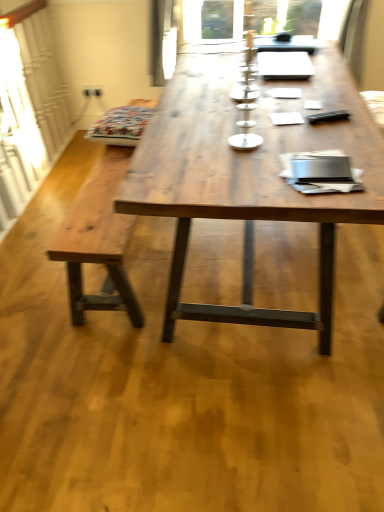
Question: Can you confirm if wooden table at center is shorter than wooden bench at left?

Choices:
 (A) no
 (B) yes

Answer: (A)

Question: Would you consider wooden table at center to be distant from wooden bench at left?

Choices:
 (A) yes
 (B) no

Answer: (B)

Question: From a real-world perspective, is wooden table at center under wooden bench at left?

Choices:
 (A) yes
 (B) no

Answer: (B)

Question: Can you confirm if wooden table at center is thinner than wooden bench at left?

Choices:
 (A) no
 (B) yes

Answer: (A)

Question: Is wooden table at center aimed at wooden bench at left?

Choices:
 (A) yes
 (B) no

Answer: (A)

Question: Does wooden table at center have a smaller size compared to wooden bench at left?

Choices:
 (A) yes
 (B) no

Answer: (B)

Question: Is wooden table at center oriented away from patterned fabric cushion at left?

Choices:
 (A) no
 (B) yes

Answer: (A)

Question: From the image's perspective, is wooden table at center on top of patterned fabric cushion at left?

Choices:
 (A) no
 (B) yes

Answer: (A)

Question: From the image's perspective, is wooden table at center located beneath patterned fabric cushion at left?

Choices:
 (A) yes
 (B) no

Answer: (A)

Question: Is the position of wooden table at center less distant than that of patterned fabric cushion at left?

Choices:
 (A) yes
 (B) no

Answer: (A)

Question: Considering the relative positions of wooden table at center and patterned fabric cushion at left in the image provided, is wooden table at center to the left of patterned fabric cushion at left from the viewer's perspective?

Choices:
 (A) yes
 (B) no

Answer: (B)

Question: Does wooden table at center have a lesser height compared to patterned fabric cushion at left?

Choices:
 (A) no
 (B) yes

Answer: (A)

Question: Is patterned fabric cushion at left far from wooden table at center?

Choices:
 (A) yes
 (B) no

Answer: (B)